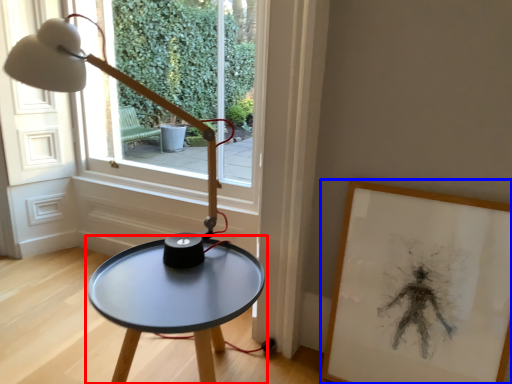
Question: Which of the following is the closest to the observer, table (highlighted by a red box) or picture frame (highlighted by a blue box)?

Choices:
 (A) table
 (B) picture frame

Answer: (A)